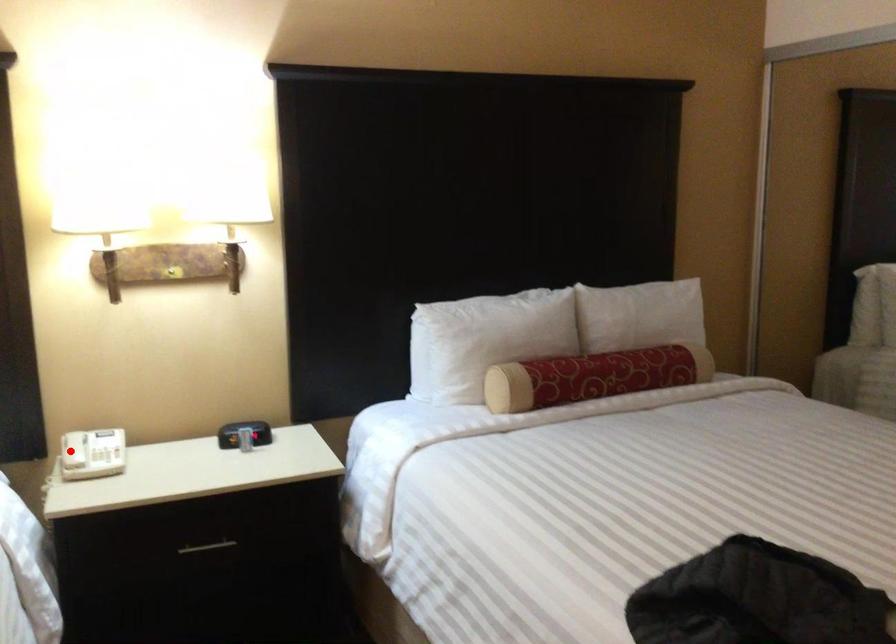
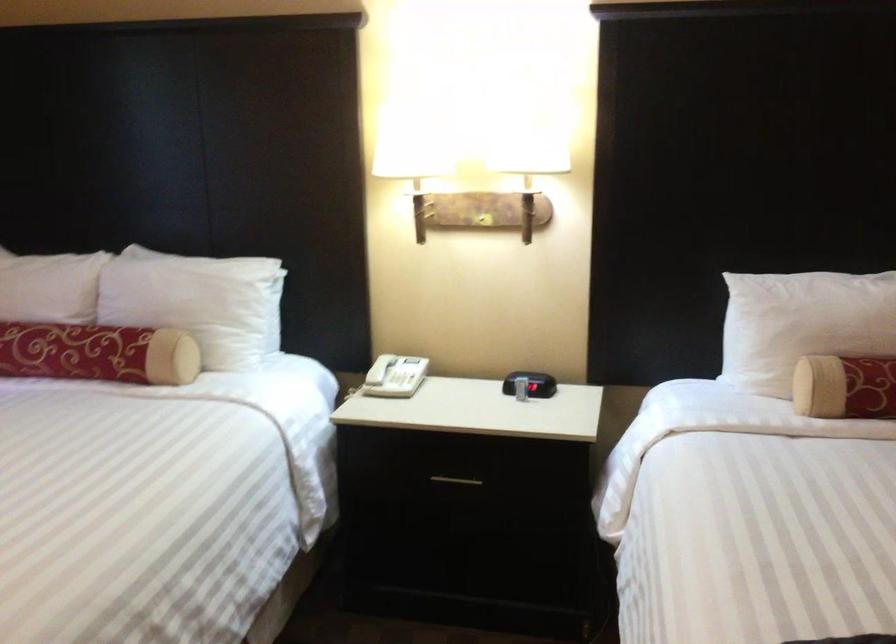
Where in the second image is the point corresponding to the highlighted location from the first image?

(380, 368)